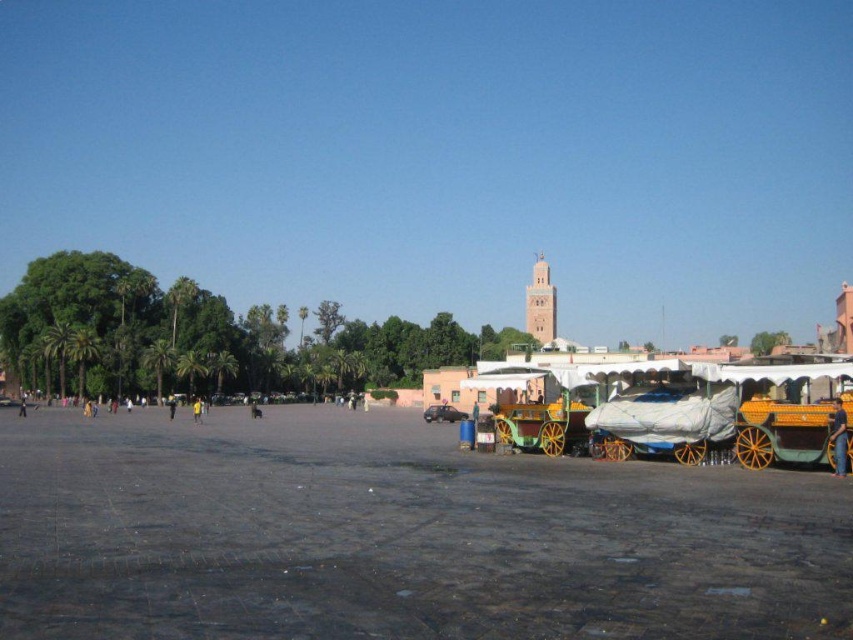
Question: Can you confirm if smooth stone pavement at center is positioned to the left of orange wood horse cart at lower right?

Choices:
 (A) yes
 (B) no

Answer: (A)

Question: Which point is farther to the camera?

Choices:
 (A) orange wood horse cart at lower right
 (B) smooth stone pavement at center
 (C) orange fabric cart at lower right
 (D) yellow fabric person at center

Answer: (D)

Question: Is light brown stone minaret at upper right above orange fabric cart at lower right?

Choices:
 (A) no
 (B) yes

Answer: (B)

Question: Estimate the real-world distances between objects in this image. Which object is closer to the yellow fabric person at center?

Choices:
 (A) orange fabric cart at lower right
 (B) orange wood horse cart at lower right
 (C) smooth stone pavement at center

Answer: (C)

Question: Does orange wood horse cart at lower right appear over yellow fabric person at center?

Choices:
 (A) no
 (B) yes

Answer: (B)

Question: Among these objects, which one is nearest to the camera?

Choices:
 (A) yellow fabric person at center
 (B) smooth stone pavement at center

Answer: (B)